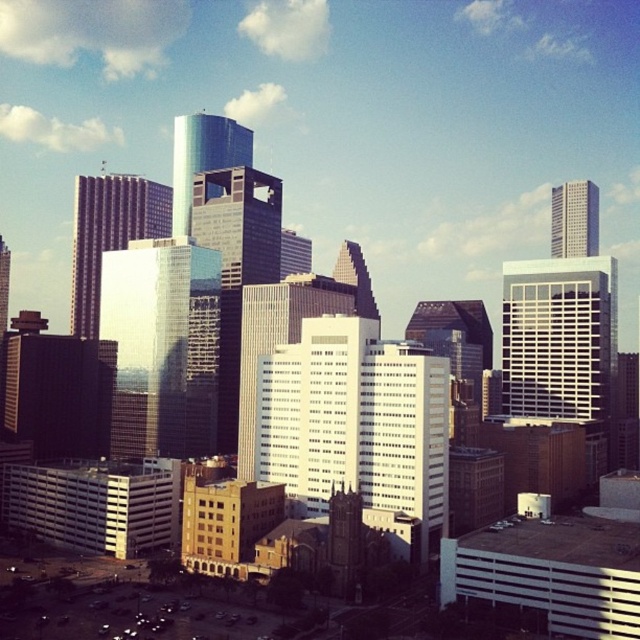
Question: Which point is farther from the camera taking this photo?

Choices:
 (A) (582, 243)
 (B) (259, 204)
 (C) (141, 256)
 (D) (80, 276)

Answer: (A)

Question: Is white glass building at center-right bigger than white glass building at upper right?

Choices:
 (A) yes
 (B) no

Answer: (B)

Question: Estimate the real-world distances between objects in this image. Which object is farther from the white glass building at center?

Choices:
 (A) white glass building at upper right
 (B) shiny glass skyscraper at center

Answer: (A)

Question: Observing the image, what is the correct spatial positioning of white glass building at center in reference to shiny glass skyscraper at center?

Choices:
 (A) below
 (B) above

Answer: (A)

Question: Which is farther from the white glass building at upper right?

Choices:
 (A) white glass building at center
 (B) reflective glass skyscraper at center
 (C) matte glass skyscraper at center-left

Answer: (A)

Question: Is matte glass skyscraper at center-left thinner than shiny glass skyscraper at center?

Choices:
 (A) yes
 (B) no

Answer: (A)